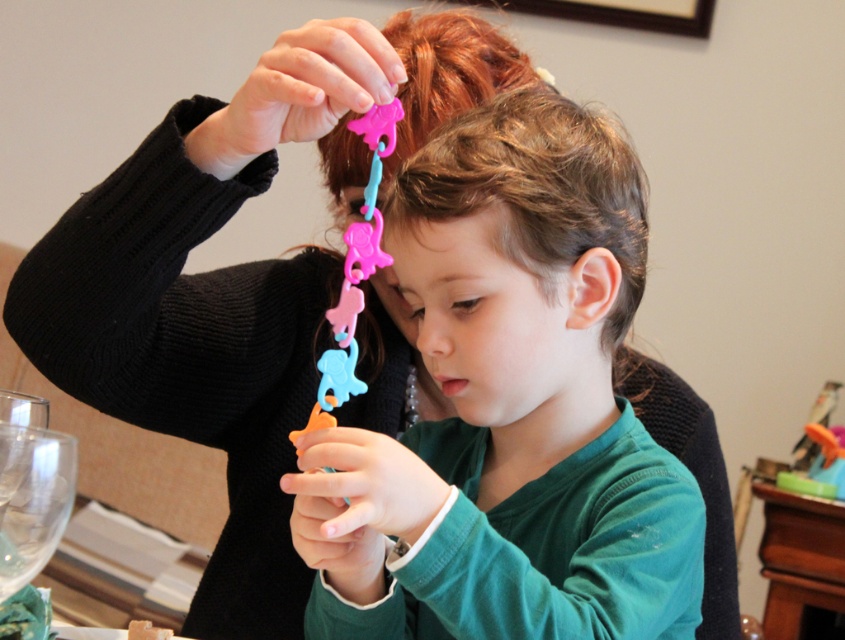
Who is positioned more to the right, matte plastic toy at center or wooden table at lower right?

wooden table at lower right is more to the right.

Does matte plastic toy at center have a lesser width compared to wooden table at lower right?

No.

Does point (489, 605) come closer to viewer compared to point (814, 547)?

Yes, it is.

You are a GUI agent. You are given a task and a screenshot of the screen. Output one action in this format:
    pyautogui.click(x=<x>, y=<y>)
    Task: Click on the matte plastic toy at center
    Image resolution: width=845 pixels, height=640 pixels.
    Given the screenshot: What is the action you would take?
    pyautogui.click(x=510, y=408)

Between matte plastic toy at center and rubber elephant chain at upper center, which one appears on the right side from the viewer's perspective?

matte plastic toy at center is more to the right.

Find the location of a particular element. matte plastic toy at center is located at coordinates (510, 408).

Is brown matte hair at center bigger than wooden table at lower right?

Correct, brown matte hair at center is larger in size than wooden table at lower right.

Between point (386, 212) and point (770, 596), which one is positioned behind?

The point (770, 596) is behind.

Locate an element on the screen. brown matte hair at center is located at coordinates (540, 195).